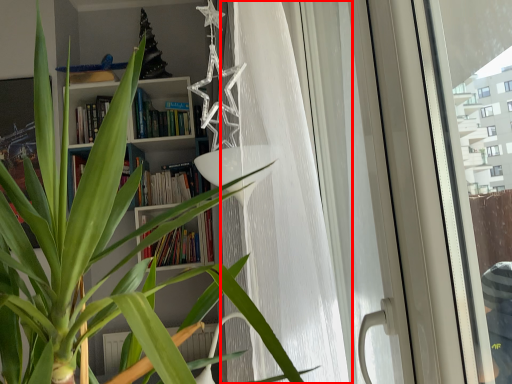
Question: Observing the image, what is the correct spatial positioning of curtain (annotated by the red box) in reference to screen door?

Choices:
 (A) right
 (B) left

Answer: (B)